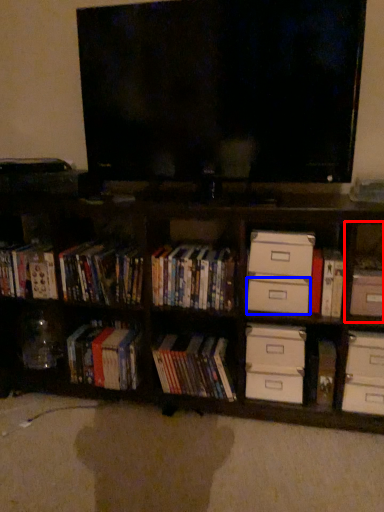
Question: Which of the following is the farthest to the observer, cabinet (highlighted by a red box) or drawer (highlighted by a blue box)?

Choices:
 (A) cabinet
 (B) drawer

Answer: (B)